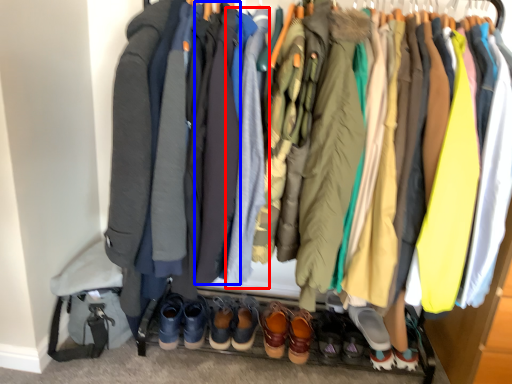
Question: Which object is closer to the camera taking this photo, robe (highlighted by a red box) or robe (highlighted by a blue box)?

Choices:
 (A) robe
 (B) robe

Answer: (A)